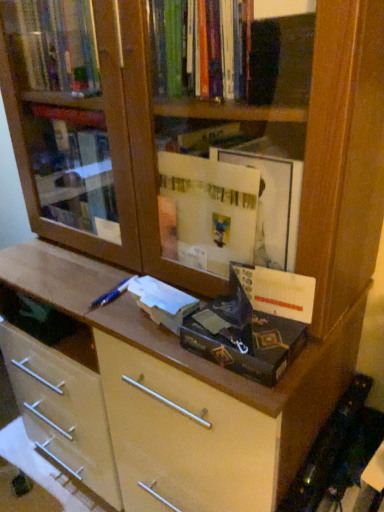
Question: In terms of height, does white matte paper at center, the second paperback book positioned from the right, look taller or shorter compared to matte cardboard paperback book at center, the 2th paperback book viewed from the left?

Choices:
 (A) tall
 (B) short

Answer: (B)

Question: In the image, is white matte paper at center, which appears as the first paperback book when viewed from the left, positioned in front of or behind matte cardboard paperback book at center, the 2th paperback book viewed from the left?

Choices:
 (A) front
 (B) behind

Answer: (B)

Question: Is white matte paper at center, the second paperback book positioned from the right, wider or thinner than matte cardboard paperback book at center, arranged as the 1th paperback book when viewed from the right?

Choices:
 (A) wide
 (B) thin

Answer: (B)

Question: Considering the positions of matte cardboard paperback book at center, the 2th paperback book viewed from the left, and white matte paper at center, which appears as the first paperback book when viewed from the left, in the image, is matte cardboard paperback book at center, the 2th paperback book viewed from the left, taller or shorter than white matte paper at center, which appears as the first paperback book when viewed from the left,?

Choices:
 (A) tall
 (B) short

Answer: (A)

Question: From a real-world perspective, relative to white matte paper at center, which appears as the first paperback book when viewed from the left, is matte cardboard paperback book at center, arranged as the 1th paperback book when viewed from the right, vertically above or below?

Choices:
 (A) above
 (B) below

Answer: (A)

Question: From the image's perspective, is matte cardboard paperback book at center, the 2th paperback book viewed from the left, located above or below white matte paper at center, the second paperback book positioned from the right?

Choices:
 (A) above
 (B) below

Answer: (A)

Question: In terms of width, does matte cardboard paperback book at center, the 2th paperback book viewed from the left, look wider or thinner when compared to white matte paper at center, which appears as the first paperback book when viewed from the left?

Choices:
 (A) thin
 (B) wide

Answer: (B)